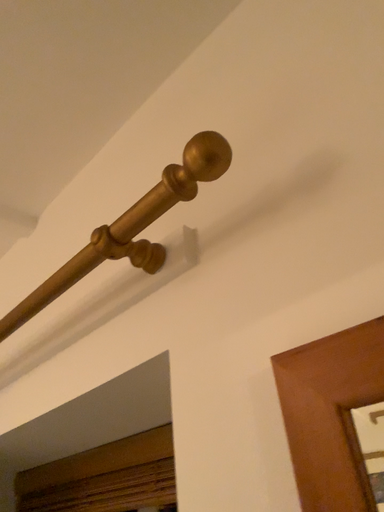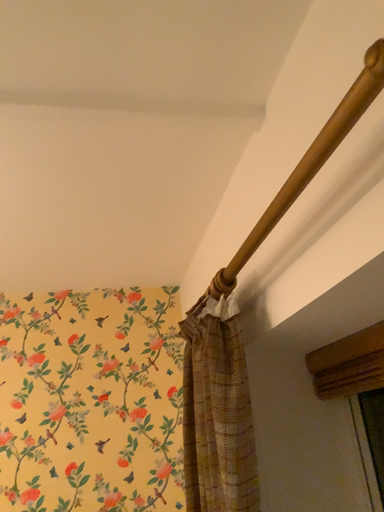
Question: Which way did the camera rotate in the video?

Choices:
 (A) rotated right
 (B) rotated left

Answer: (B)